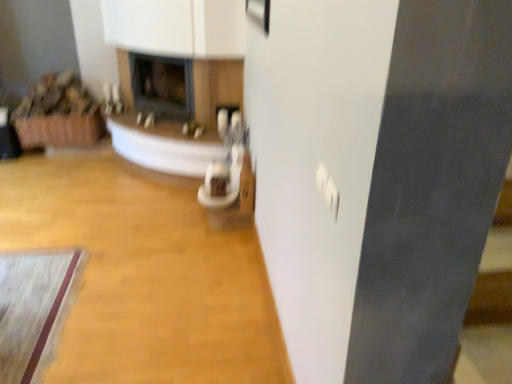
Question: In the image, is wooden floor at center on the left side or the right side of matte black fireplace at center, the second fireplace positioned from the left?

Choices:
 (A) right
 (B) left

Answer: (B)

Question: Is point (129, 294) positioned closer to the camera than point (233, 100)?

Choices:
 (A) farther
 (B) closer

Answer: (B)

Question: Which is farther from the wooden floor at center?

Choices:
 (A) matte black fireplace at center, the 2th fireplace from the right
 (B) matte black fireplace at center, acting as the first fireplace starting from the right

Answer: (A)

Question: Estimate the real-world distances between objects in this image. Which object is closer to the matte black fireplace at center, the first fireplace when ordered from left to right?

Choices:
 (A) wooden floor at center
 (B) matte black fireplace at center, the second fireplace positioned from the left

Answer: (B)